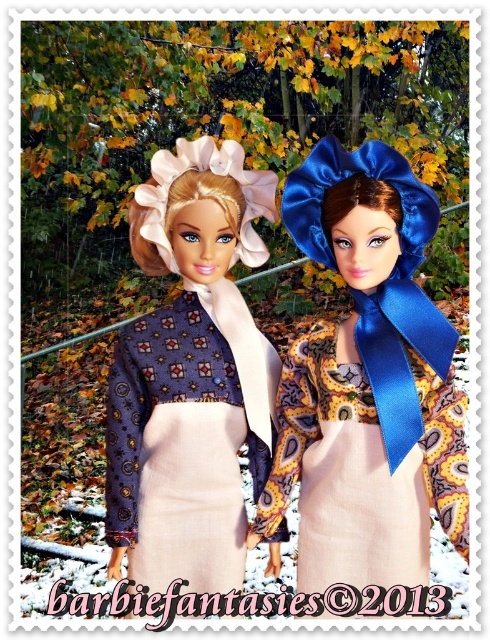
You are a photographer trying to capture a closeup of the blue satin bow at upper right and the matte blue fabric dress at center. Which object should you focus on first if you want to ensure both are in focus without adjusting the camera settings?

The blue satin bow at upper right is positioned on the right side of matte blue fabric dress at center, so focusing on the matte blue fabric dress at center first would ensure both are in focus since it is closer to the camera.

You are a fashion designer observing the two dolls in the snowy autumn setting. You notice the blue satin bow at upper right and the matte blue fabric dress at center. Which of these two items is smaller in size?

The blue satin bow at upper right has a smaller size compared to the matte blue fabric dress at center, so the blue satin bow at upper right is smaller.